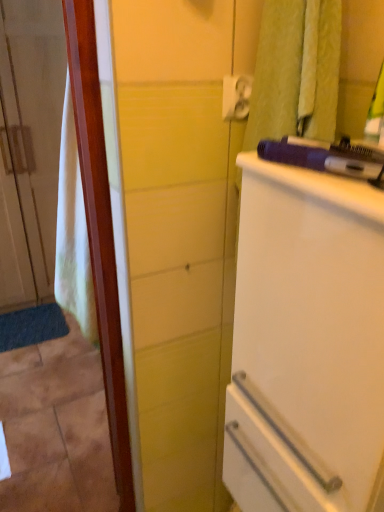
You are a GUI agent. You are given a task and a screenshot of the screen. Output one action in this format:
    pyautogui.click(x=<x>, y=<y>)
    Task: Click on the white glossy refrigerator at right
    This screenshot has width=384, height=512.
    Given the screenshot: What is the action you would take?
    pyautogui.click(x=306, y=343)

At what (x,y) coordinates should I click in order to perform the action: click on white fabric door at left. Please return your answer as a coordinate pair (x, y). This screenshot has width=384, height=512. Looking at the image, I should click on (29, 146).

From the image's perspective, which is below, white glossy refrigerator at right or white plastic towel bar at upper right?

white glossy refrigerator at right, from the image's perspective.

Can you tell me how much white glossy refrigerator at right and white plastic towel bar at upper right differ in facing direction?

The angle between the facing direction of white glossy refrigerator at right and the facing direction of white plastic towel bar at upper right is 91.5 degrees.

Looking at this image, is white glossy refrigerator at right oriented away from white plastic towel bar at upper right?

white glossy refrigerator at right does not have its back to white plastic towel bar at upper right.

Where is `refrigerator that is in front of the white plastic towel bar at upper right`? The height and width of the screenshot is (512, 384). refrigerator that is in front of the white plastic towel bar at upper right is located at coordinates (x=306, y=343).

This screenshot has width=384, height=512. What are the coordinates of `towel bar above the white fabric door at left (from a real-world perspective)` in the screenshot? It's located at (236, 96).

Which is behind, white plastic towel bar at upper right or white fabric door at left?

Positioned behind is white fabric door at left.

Is white plastic towel bar at upper right not within white fabric door at left?

Yes, white plastic towel bar at upper right is not within white fabric door at left.

Which of these two, white fabric door at left or white plastic towel bar at upper right, is smaller?

With smaller size is white plastic towel bar at upper right.

Where is `towel bar located above the white fabric door at left (from a real-world perspective)`? Image resolution: width=384 pixels, height=512 pixels. towel bar located above the white fabric door at left (from a real-world perspective) is located at coordinates (236, 96).

Does point (30, 22) lie in front of point (227, 90)?

No, (30, 22) is behind (227, 90).

From the image's perspective, between purple plastic hairdryer at upper right and white fabric door at left, who is located below?

Answer: purple plastic hairdryer at upper right.

Is purple plastic hairdryer at upper right facing towards white fabric door at left?

No, purple plastic hairdryer at upper right is not oriented towards white fabric door at left.

Is purple plastic hairdryer at upper right far from white fabric door at left?

purple plastic hairdryer at upper right is positioned a significant distance from white fabric door at left.

Is white fabric door at left not within purple plastic hairdryer at upper right?

Yes, white fabric door at left is outside of purple plastic hairdryer at upper right.

From a real-world perspective, between white fabric door at left and purple plastic hairdryer at upper right, who is vertically higher?

In real-world perspective, purple plastic hairdryer at upper right is above.

Is white fabric door at left oriented towards purple plastic hairdryer at upper right?

Yes, white fabric door at left is turned towards purple plastic hairdryer at upper right.

How many degrees apart are the facing directions of white fabric door at left and purple plastic hairdryer at upper right?

There is a 89.5-degree angle between the facing directions of white fabric door at left and purple plastic hairdryer at upper right.

Who is bigger, white glossy refrigerator at right or purple plastic hairdryer at upper right?

white glossy refrigerator at right.

Is white glossy refrigerator at right facing towards purple plastic hairdryer at upper right?

No, white glossy refrigerator at right is not facing towards purple plastic hairdryer at upper right.

Considering the sizes of white glossy refrigerator at right and purple plastic hairdryer at upper right in the image, is white glossy refrigerator at right taller or shorter than purple plastic hairdryer at upper right?

Clearly, white glossy refrigerator at right is taller compared to purple plastic hairdryer at upper right.

From a real-world perspective, which is physically below, white glossy refrigerator at right or purple plastic hairdryer at upper right?

white glossy refrigerator at right is physically lower.

From the image's perspective, which one is positioned higher, white glossy refrigerator at right or white fabric door at left?

white fabric door at left.

Between white glossy refrigerator at right and white fabric door at left, which one has larger size?

white fabric door at left is bigger.

Based on the photo, is white glossy refrigerator at right to the left of white fabric door at left from the viewer's perspective?

No.

Looking at their sizes, would you say white glossy refrigerator at right is wider or thinner than white fabric door at left?

Considering their sizes, white glossy refrigerator at right looks slimmer than white fabric door at left.

The width and height of the screenshot is (384, 512). Identify the location of refrigerator below the white plastic towel bar at upper right (from a real-world perspective). (306, 343).

Identify the location of towel bar on the right of white fabric door at left. Image resolution: width=384 pixels, height=512 pixels. (236, 96).

When comparing their distances from white plastic towel bar at upper right, does white glossy refrigerator at right or purple plastic hairdryer at upper right seem closer?

purple plastic hairdryer at upper right is closer to white plastic towel bar at upper right.

Looking at the image, which one is located further to white glossy refrigerator at right, white plastic towel bar at upper right or purple plastic hairdryer at upper right?

white plastic towel bar at upper right.

Considering their positions, is white fabric door at left positioned closer to white plastic towel bar at upper right than white glossy refrigerator at right?

white glossy refrigerator at right is closer to white plastic towel bar at upper right.

In the scene shown: Estimate the real-world distances between objects in this image. Which object is further from white glossy refrigerator at right, white fabric door at left or white plastic towel bar at upper right?

The object further to white glossy refrigerator at right is white fabric door at left.

Which object lies further to the anchor point white fabric door at left, purple plastic hairdryer at upper right or white glossy refrigerator at right?

purple plastic hairdryer at upper right is further to white fabric door at left.

Considering their positions, is purple plastic hairdryer at upper right positioned closer to white glossy refrigerator at right than white fabric door at left?

purple plastic hairdryer at upper right lies closer to white glossy refrigerator at right than the other object.

Estimate the real-world distances between objects in this image. Which object is closer to white glossy refrigerator at right, white plastic towel bar at upper right or white fabric door at left?

white plastic towel bar at upper right lies closer to white glossy refrigerator at right than the other object.

When comparing their distances from purple plastic hairdryer at upper right, does white glossy refrigerator at right or white plastic towel bar at upper right seem further?

white plastic towel bar at upper right is positioned further to the anchor purple plastic hairdryer at upper right.

Locate an element on the screen. The image size is (384, 512). counter top between white plastic towel bar at upper right and white glossy refrigerator at right in the up-down direction is located at coordinates (320, 186).

Image resolution: width=384 pixels, height=512 pixels. In order to click on counter top located between white glossy refrigerator at right and white fabric door at left in the depth direction in this screenshot , I will do `click(320, 186)`.

Image resolution: width=384 pixels, height=512 pixels. In order to click on towel bar between purple plastic hairdryer at upper right and white fabric door at left along the z-axis in this screenshot , I will do `click(236, 96)`.

You are a GUI agent. You are given a task and a screenshot of the screen. Output one action in this format:
    pyautogui.click(x=<x>, y=<y>)
    Task: Click on the towel bar between white glossy refrigerator at right and white fabric door at left from front to back
    The width and height of the screenshot is (384, 512).
    Given the screenshot: What is the action you would take?
    pyautogui.click(x=236, y=96)